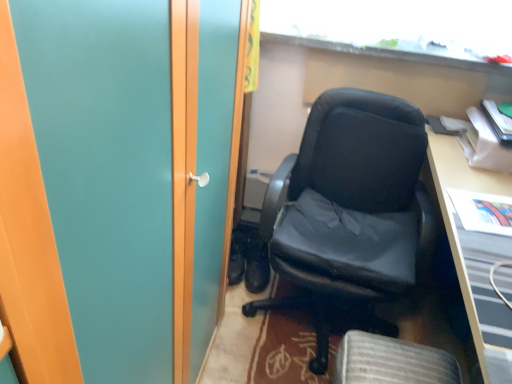
Question: From the image's perspective, relative to wooden desk at right, is black leather shoes at center, the 2th footwear when ordered from right to left, above or below?

Choices:
 (A) below
 (B) above

Answer: (B)

Question: In the image, is black leather shoes at center, the 2th footwear when ordered from right to left, on the left side or the right side of wooden desk at right?

Choices:
 (A) right
 (B) left

Answer: (B)

Question: Which object is positioned farthest from the black leather chair at center?

Choices:
 (A) black leather swivel chair at lower center
 (B) wooden desk at right
 (C) black leather shoes at center, marked as the 1th footwear in a right-to-left arrangement
 (D) black leather shoes at center, the 2th footwear when ordered from right to left
 (E) transparent glass window at upper center

Answer: (D)

Question: Based on their relative distances, which object is farther from the black leather chair at center?

Choices:
 (A) black leather shoes at center, which ranks as the 1th footwear in left-to-right order
 (B) wooden desk at right
 (C) black leather swivel chair at lower center
 (D) transparent glass window at upper center
 (E) black leather shoes at center, marked as the 1th footwear in a right-to-left arrangement

Answer: (A)